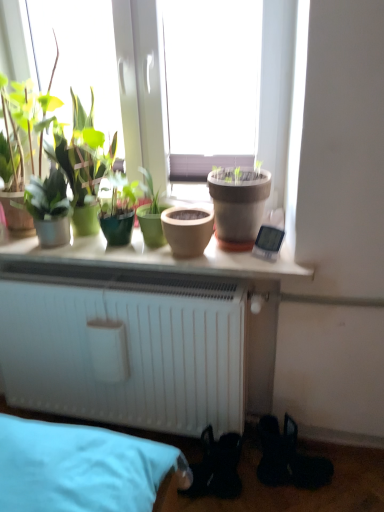
Describe the element at coordinates (238, 203) in the screenshot. The width and height of the screenshot is (384, 512). I see `matte clay pot at center, which is counted as the first flowerpot, starting from the right` at that location.

The width and height of the screenshot is (384, 512). Identify the location of matte clay pot at center. (155, 258).

Does matte clay pot at center, arranged as the 1th flowerpot when viewed from the left, turn towards green matte pot at center, the 2th houseplant when ordered from left to right?

No, matte clay pot at center, arranged as the 1th flowerpot when viewed from the left, is not aimed at green matte pot at center, the 2th houseplant when ordered from left to right.

Is matte clay pot at center, which is the second flowerpot from right to left, not near green matte pot at center, the 2th houseplant when ordered from left to right?

No, matte clay pot at center, which is the second flowerpot from right to left, is in close proximity to green matte pot at center, the 2th houseplant when ordered from left to right.

Is matte clay pot at center, arranged as the 1th flowerpot when viewed from the left, smaller than green matte pot at center, the 2th houseplant when ordered from left to right?

Yes, matte clay pot at center, arranged as the 1th flowerpot when viewed from the left, is smaller than green matte pot at center, the 2th houseplant when ordered from left to right.

Which is behind, point (176, 245) or point (136, 213)?

The point (136, 213) is farther.

Between point (244, 195) and point (284, 262), which one is positioned in front?

The point (244, 195) is in front.

Is matte clay pot at center, which is counted as the first flowerpot, starting from the right, not near matte clay pot at center?

They are positioned close to each other.

Identify the location of window sill beneath the matte clay pot at center, which appears as the second flowerpot when viewed from the left (from a real-world perspective). (155, 258).

Does matte clay pot at center, which is counted as the first flowerpot, starting from the right, have a lesser width compared to matte clay pot at center?

Yes.

Is matte clay pot at center, which is the second flowerpot from right to left, at the back of green matte plant at left, which is counted as the 2th houseplant, starting from the right?

No, matte clay pot at center, which is the second flowerpot from right to left, is not at the back of green matte plant at left, which is counted as the 2th houseplant, starting from the right.

Considering the positions of objects green matte plant at left, which is counted as the 2th houseplant, starting from the right, and matte clay pot at center, which is the second flowerpot from right to left, in the image provided, who is more to the left, green matte plant at left, which is counted as the 2th houseplant, starting from the right, or matte clay pot at center, which is the second flowerpot from right to left,?

Positioned to the left is green matte plant at left, which is counted as the 2th houseplant, starting from the right.

Which object is more forward, green matte plant at left, which is counted as the 1th houseplant, starting from the left, or matte clay pot at center, arranged as the 1th flowerpot when viewed from the left?

matte clay pot at center, arranged as the 1th flowerpot when viewed from the left, is closer to the camera.

Locate an element on the screen. This screenshot has height=512, width=384. window sill on the left of green matte pot at center, positioned as the first houseplant in right-to-left order is located at coordinates 155,258.

From a real-world perspective, is matte clay pot at center positioned over green matte pot at center, positioned as the first houseplant in right-to-left order, based on gravity?

Incorrect, from a real-world perspective, matte clay pot at center is lower than green matte pot at center, positioned as the first houseplant in right-to-left order.

Could you tell me if matte clay pot at center is facing green matte pot at center, the 2th houseplant when ordered from left to right?

No, matte clay pot at center is not facing towards green matte pot at center, the 2th houseplant when ordered from left to right.

Looking at this image, from a real-world perspective, between green matte plant at left, which is counted as the 2th houseplant, starting from the right, and matte clay pot at center, which is counted as the first flowerpot, starting from the right, who is vertically higher?

matte clay pot at center, which is counted as the first flowerpot, starting from the right, from a real-world perspective.

Which is behind, point (61, 224) or point (252, 242)?

The point (61, 224) is farther.

Considering the positions of objects green matte plant at left, which is counted as the 2th houseplant, starting from the right, and matte clay pot at center, which is counted as the first flowerpot, starting from the right, in the image provided, who is in front, green matte plant at left, which is counted as the 2th houseplant, starting from the right, or matte clay pot at center, which is counted as the first flowerpot, starting from the right,?

matte clay pot at center, which is counted as the first flowerpot, starting from the right, is more forward.

Can you see green matte plant at left, which is counted as the 1th houseplant, starting from the left, touching matte clay pot at center, which appears as the second flowerpot when viewed from the left?

No, green matte plant at left, which is counted as the 1th houseplant, starting from the left, is not making contact with matte clay pot at center, which appears as the second flowerpot when viewed from the left.

Considering the points (207, 234) and (53, 229), which point is in front, point (207, 234) or point (53, 229)?

The point (207, 234) is in front.

Considering their positions, is matte clay pot at center, arranged as the 1th flowerpot when viewed from the left, located in front of or behind green matte plant at left, which is counted as the 1th houseplant, starting from the left?

matte clay pot at center, arranged as the 1th flowerpot when viewed from the left, is positioned closer to the viewer than green matte plant at left, which is counted as the 1th houseplant, starting from the left.

Is matte clay pot at center, which is the second flowerpot from right to left, at the left side of green matte plant at left, which is counted as the 2th houseplant, starting from the right?

No.

You are a GUI agent. You are given a task and a screenshot of the screen. Output one action in this format:
    pyautogui.click(x=<x>, y=<y>)
    Task: Click on the flowerpot that is the 1st one when counting forward from the green matte plant at left, which is counted as the 1th houseplant, starting from the left
    The height and width of the screenshot is (512, 384).
    Given the screenshot: What is the action you would take?
    pyautogui.click(x=187, y=229)

Which of these two, matte clay pot at center, which appears as the second flowerpot when viewed from the left, or green matte plant at left, which is counted as the 2th houseplant, starting from the right, stands shorter?

Standing shorter between the two is green matte plant at left, which is counted as the 2th houseplant, starting from the right.

Does matte clay pot at center, which is counted as the first flowerpot, starting from the right, have a smaller size compared to green matte plant at left, which is counted as the 2th houseplant, starting from the right?

No, matte clay pot at center, which is counted as the first flowerpot, starting from the right, is not smaller than green matte plant at left, which is counted as the 2th houseplant, starting from the right.

Considering the points (246, 198) and (21, 207), which point is in front, point (246, 198) or point (21, 207)?

The point (246, 198) is more forward.

You are a GUI agent. You are given a task and a screenshot of the screen. Output one action in this format:
    pyautogui.click(x=<x>, y=<y>)
    Task: Click on the flowerpot that is the 1st object to the right of the green matte pot at center, the 2th houseplant when ordered from left to right, starting at the anchor
    The width and height of the screenshot is (384, 512).
    Given the screenshot: What is the action you would take?
    pyautogui.click(x=187, y=229)

Where is `the 1st flowerpot behind the matte clay pot at center`? Image resolution: width=384 pixels, height=512 pixels. the 1st flowerpot behind the matte clay pot at center is located at coordinates (238, 203).

Based on their spatial positions, is matte clay pot at center, which appears as the second flowerpot when viewed from the left, or matte clay pot at center, arranged as the 1th flowerpot when viewed from the left, closer to matte clay pot at center?

matte clay pot at center, arranged as the 1th flowerpot when viewed from the left, lies closer to matte clay pot at center than the other object.

Looking at the image, which one is located closer to matte clay pot at center, which appears as the second flowerpot when viewed from the left, green matte plant at left, which is counted as the 1th houseplant, starting from the left, or matte clay pot at center, which is the second flowerpot from right to left?

matte clay pot at center, which is the second flowerpot from right to left, lies closer to matte clay pot at center, which appears as the second flowerpot when viewed from the left, than the other object.

From the image, which object appears to be farther from green matte pot at center, positioned as the first houseplant in right-to-left order, matte clay pot at center, which is the second flowerpot from right to left, or green matte plant at left, which is counted as the 2th houseplant, starting from the right?

green matte plant at left, which is counted as the 2th houseplant, starting from the right, is further to green matte pot at center, positioned as the first houseplant in right-to-left order.

When comparing their distances from matte clay pot at center, which is counted as the first flowerpot, starting from the right, does matte clay pot at center, which is the second flowerpot from right to left, or green matte plant at left, which is counted as the 1th houseplant, starting from the left, seem further?

green matte plant at left, which is counted as the 1th houseplant, starting from the left.

Considering their positions, is matte clay pot at center, which appears as the second flowerpot when viewed from the left, positioned closer to green matte plant at left, which is counted as the 2th houseplant, starting from the right, than matte clay pot at center?

Among the two, matte clay pot at center is located nearer to green matte plant at left, which is counted as the 2th houseplant, starting from the right.

Considering their positions, is matte clay pot at center positioned closer to matte clay pot at center, which is the second flowerpot from right to left, than green matte pot at center, the 2th houseplant when ordered from left to right?

green matte pot at center, the 2th houseplant when ordered from left to right, is positioned closer to the anchor matte clay pot at center, which is the second flowerpot from right to left.

Considering their positions, is green matte pot at center, the 2th houseplant when ordered from left to right, positioned closer to matte clay pot at center than green matte plant at left, which is counted as the 1th houseplant, starting from the left?

Among the two, green matte pot at center, the 2th houseplant when ordered from left to right, is located nearer to matte clay pot at center.

When comparing their distances from green matte plant at left, which is counted as the 2th houseplant, starting from the right, does matte clay pot at center, arranged as the 1th flowerpot when viewed from the left, or matte clay pot at center seem closer?

matte clay pot at center lies closer to green matte plant at left, which is counted as the 2th houseplant, starting from the right, than the other object.

Locate an element on the screen. The width and height of the screenshot is (384, 512). flowerpot located between matte clay pot at center and matte clay pot at center, which appears as the second flowerpot when viewed from the left, in the left-right direction is located at coordinates (187, 229).

Locate an element on the screen. houseplant between matte clay pot at center and matte clay pot at center, arranged as the 1th flowerpot when viewed from the left is located at coordinates (151, 213).

This screenshot has width=384, height=512. What are the coordinates of `window sill situated between green matte plant at left, which is counted as the 1th houseplant, starting from the left, and matte clay pot at center, which is the second flowerpot from right to left, from left to right` in the screenshot? It's located at (155, 258).

The image size is (384, 512). I want to click on window sill located between green matte plant at left, which is counted as the 1th houseplant, starting from the left, and matte clay pot at center, which appears as the second flowerpot when viewed from the left, in the left-right direction, so click(x=155, y=258).